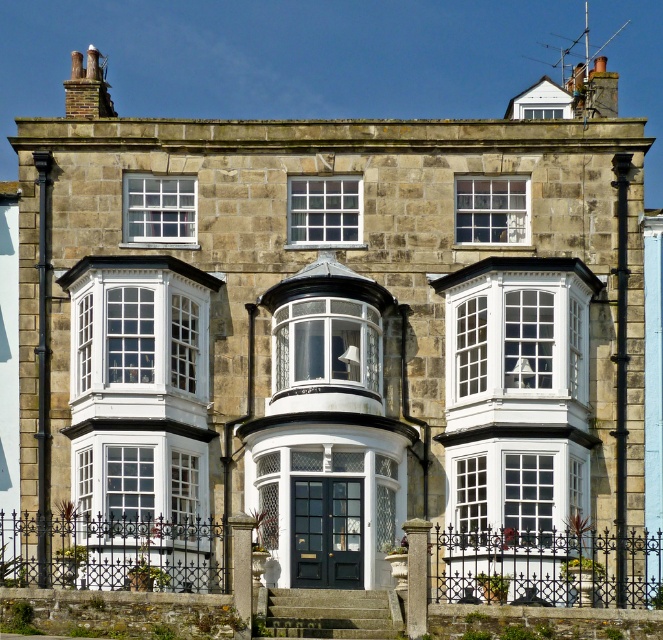
You are standing in front of the two story stone building. There is a white glass window at upper center located at point (324, 211). Is the white glass window at upper center part of the central curved bay window or one of the rectangular windows on the second floor?

The white glass window at upper center is part of the central curved bay window because it is located at point (324, 211), which is the position of the central bay window as described.

You are standing in front of a two story stone building with bay windows. You notice two points marked on the building facade at coordinates point (314, 337) and point (294, 228). Which of these points is closer to you?

Point (314, 337) is in front of point (294, 228), so it is closer to you.

You are standing in front of the two story stone building. You see the clear glass bay window at center and the white glass window at upper center. Which of these two windows is positioned to the left of the other?

The clear glass bay window at center is positioned to the left of the white glass window at upper center.